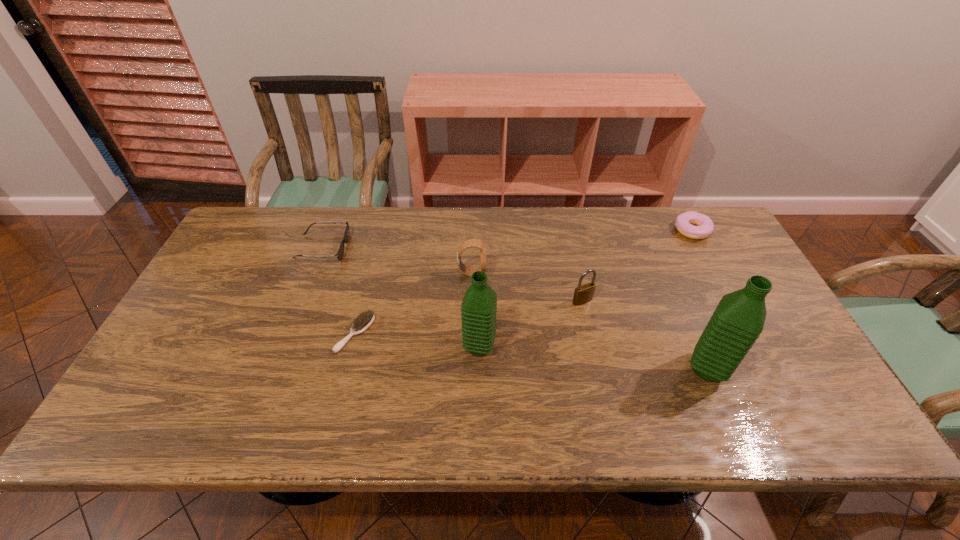
Identify the location of the shortest object. This screenshot has width=960, height=540. (361, 323).

Find the location of a particular element. This screenshot has height=540, width=960. free space located on the back of the left water bottle is located at coordinates (479, 272).

Identify the location of blank space located 0.170m on the right of the taller water bottle. The height and width of the screenshot is (540, 960). (800, 369).

Locate an element on the screen. The width and height of the screenshot is (960, 540). free space located on the front-facing side of the leftmost object is located at coordinates (445, 248).

Where is `vacant space located on the front of the doughnut`? The image size is (960, 540). vacant space located on the front of the doughnut is located at coordinates (708, 260).

In order to click on vacant space located on the face of the watch in this screenshot , I will do `click(513, 273)`.

Image resolution: width=960 pixels, height=540 pixels. I want to click on vacant space located on the front of the padlock, so click(x=598, y=375).

The image size is (960, 540). In order to click on free region located 0.360m on the left of the sixth object from right to left in this screenshot , I will do (200, 333).

The width and height of the screenshot is (960, 540). In order to click on sunglasses present at the far edge in this screenshot , I will do `click(339, 255)`.

Locate an element on the screen. This screenshot has width=960, height=540. doughnut present at the far edge is located at coordinates (705, 227).